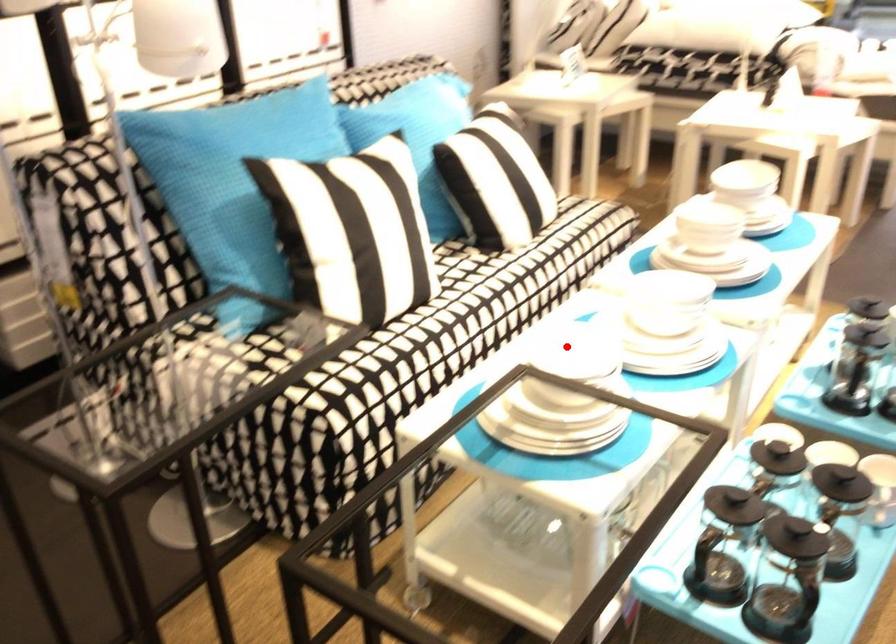
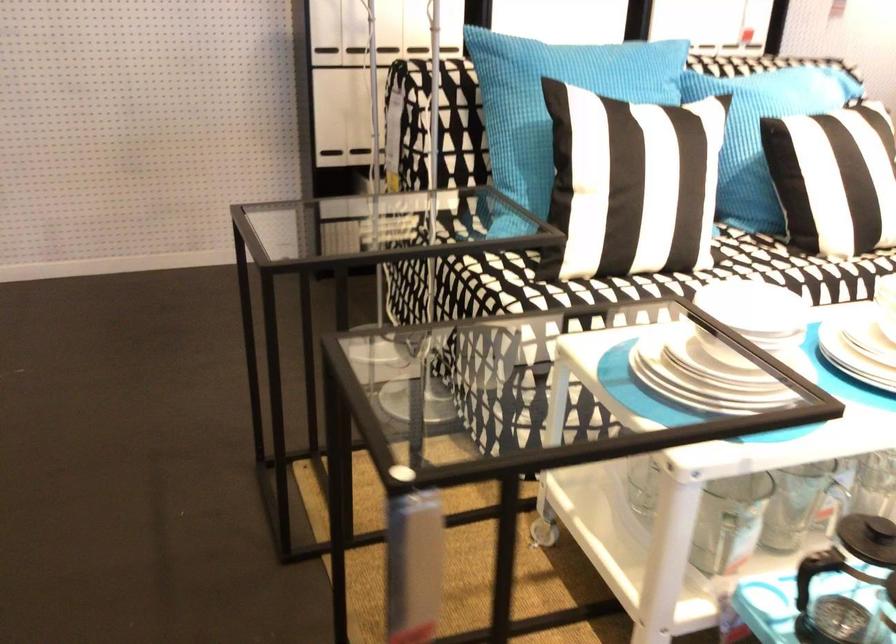
Question: A red point is marked in image1. In image2, is the corresponding 3D point closer to the camera or farther? Reply with the corresponding letter.

Choices:
 (A) The corresponding 3D point is closer.
 (B) The corresponding 3D point is farther.

Answer: (A)